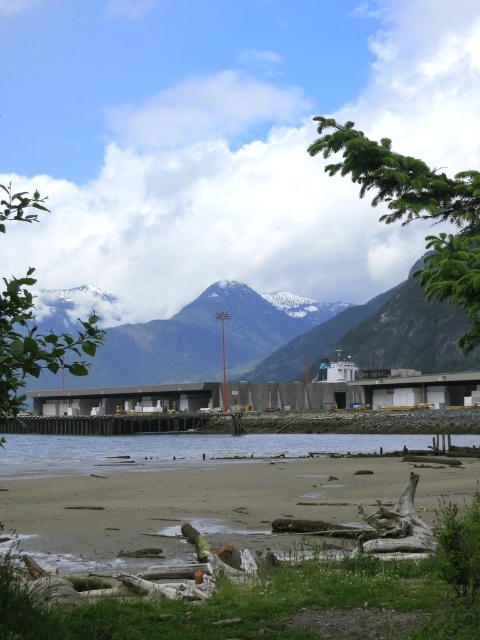
From the picture: Between sandy beach at lower center and clear water at lower center, which one is positioned higher?

sandy beach at lower center is higher up.

In the scene shown: Is sandy beach at lower center smaller than clear water at lower center?

Actually, sandy beach at lower center might be larger than clear water at lower center.

You are a GUI agent. You are given a task and a screenshot of the screen. Output one action in this format:
    pyautogui.click(x=<x>, y=<y>)
    Task: Click on the sandy beach at lower center
    This screenshot has height=640, width=480.
    Given the screenshot: What is the action you would take?
    pyautogui.click(x=182, y=490)

Where is `sandy beach at lower center`? This screenshot has height=640, width=480. sandy beach at lower center is located at coordinates (182, 490).

Is point (479, 193) less distant than point (169, 454)?

That is True.

Is green leafy tree at upper right above clear water at lower center?

Yes.

At what (x,y) coordinates should I click in order to perform the action: click on green leafy tree at upper right. Please return your answer as a coordinate pair (x, y). This screenshot has width=480, height=640. Looking at the image, I should click on (417, 211).

Who is more forward, (85, 561) or (431, 198)?

Point (431, 198) is in front.

Looking at this image, is sandy beach at lower center wider than green leafy tree at upper right?

Correct, the width of sandy beach at lower center exceeds that of green leafy tree at upper right.

Is point (379, 496) closer to camera compared to point (467, 278)?

No, it is behind (467, 278).

Identify the location of sandy beach at lower center. (182, 490).